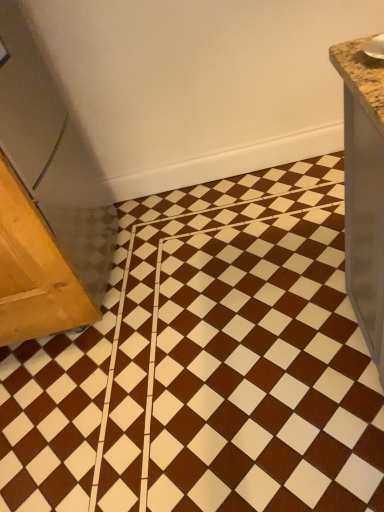
Image resolution: width=384 pixels, height=512 pixels. Describe the element at coordinates (34, 271) in the screenshot. I see `wooden table at left` at that location.

Image resolution: width=384 pixels, height=512 pixels. What are the coordinates of `wooden table at left` in the screenshot? It's located at (34, 271).

Describe the element at coordinates (206, 365) in the screenshot. This screenshot has height=512, width=384. I see `brown glossy ceramic tile at center` at that location.

You are a GUI agent. You are given a task and a screenshot of the screen. Output one action in this format:
    pyautogui.click(x=<x>, y=<y>)
    Task: Click on the brown glossy ceramic tile at center
    This screenshot has width=384, height=512.
    Given the screenshot: What is the action you would take?
    pyautogui.click(x=206, y=365)

Where is `wooden table at left`? The width and height of the screenshot is (384, 512). wooden table at left is located at coordinates (34, 271).

Which object is positioned more to the left, wooden table at left or brown glossy ceramic tile at center?

wooden table at left is more to the left.

Considering their positions, is wooden table at left located in front of or behind brown glossy ceramic tile at center?

wooden table at left is behind brown glossy ceramic tile at center.

Considering the points (35, 244) and (340, 261), which point is behind, point (35, 244) or point (340, 261)?

The point (340, 261) is behind.

From the image's perspective, is wooden table at left on brown glossy ceramic tile at center?

No.

From a real-world perspective, is wooden table at left positioned under brown glossy ceramic tile at center based on gravity?

No, from a real-world perspective, wooden table at left is not under brown glossy ceramic tile at center.

In terms of width, does wooden table at left look wider or thinner when compared to brown glossy ceramic tile at center?

In the image, wooden table at left appears to be more narrow than brown glossy ceramic tile at center.

Looking at this image, considering the sizes of objects wooden table at left and brown glossy ceramic tile at center in the image provided, who is taller, wooden table at left or brown glossy ceramic tile at center?

Standing taller between the two is wooden table at left.

Who is smaller, wooden table at left or brown glossy ceramic tile at center?

With smaller size is wooden table at left.

Is wooden table at left positioned beyond the bounds of brown glossy ceramic tile at center?

Yes.

In the scene shown: Is wooden table at left positioned far away from brown glossy ceramic tile at center?

That's not correct — wooden table at left is a little close to brown glossy ceramic tile at center.

Does wooden table at left turn towards brown glossy ceramic tile at center?

No, wooden table at left is not facing towards brown glossy ceramic tile at center.

How far apart are wooden table at left and brown glossy ceramic tile at center?

The distance of wooden table at left from brown glossy ceramic tile at center is 52.89 centimeters.

You are a GUI agent. You are given a task and a screenshot of the screen. Output one action in this format:
    pyautogui.click(x=<x>, y=<y>)
    Task: Click on the furniture below the brown glossy ceramic tile at center (from the image's perspective)
    
    Given the screenshot: What is the action you would take?
    pyautogui.click(x=34, y=271)

Which is more to the right, brown glossy ceramic tile at center or wooden table at left?

brown glossy ceramic tile at center.

Is brown glossy ceramic tile at center further to camera compared to wooden table at left?

No.

Does point (115, 481) come in front of point (41, 269)?

Yes, point (115, 481) is closer to viewer.

From the image's perspective, between brown glossy ceramic tile at center and wooden table at left, which one is located above?

brown glossy ceramic tile at center, from the image's perspective.

From a real-world perspective, which object rests below the other?

brown glossy ceramic tile at center.

Is brown glossy ceramic tile at center thinner than wooden table at left?

No, brown glossy ceramic tile at center is not thinner than wooden table at left.

Does brown glossy ceramic tile at center have a lesser height compared to wooden table at left?

Correct, brown glossy ceramic tile at center is not as tall as wooden table at left.

In the scene shown: Considering the relative sizes of brown glossy ceramic tile at center and wooden table at left in the image provided, is brown glossy ceramic tile at center smaller than wooden table at left?

No, brown glossy ceramic tile at center is not smaller than wooden table at left.

Do you think brown glossy ceramic tile at center is within wooden table at left, or outside of it?

brown glossy ceramic tile at center is outside wooden table at left.

Can you see brown glossy ceramic tile at center touching wooden table at left?

No, brown glossy ceramic tile at center is not in contact with wooden table at left.

Is brown glossy ceramic tile at center positioned with its back to wooden table at left?

brown glossy ceramic tile at center does not have its back to wooden table at left.

Where is `furniture that appears behind the brown glossy ceramic tile at center`? furniture that appears behind the brown glossy ceramic tile at center is located at coordinates (34, 271).

The image size is (384, 512). I want to click on ceramic tile lying in front of the wooden table at left, so click(x=206, y=365).

This screenshot has width=384, height=512. What are the coordinates of `ceramic tile below the wooden table at left (from a real-world perspective)` in the screenshot? It's located at (206, 365).